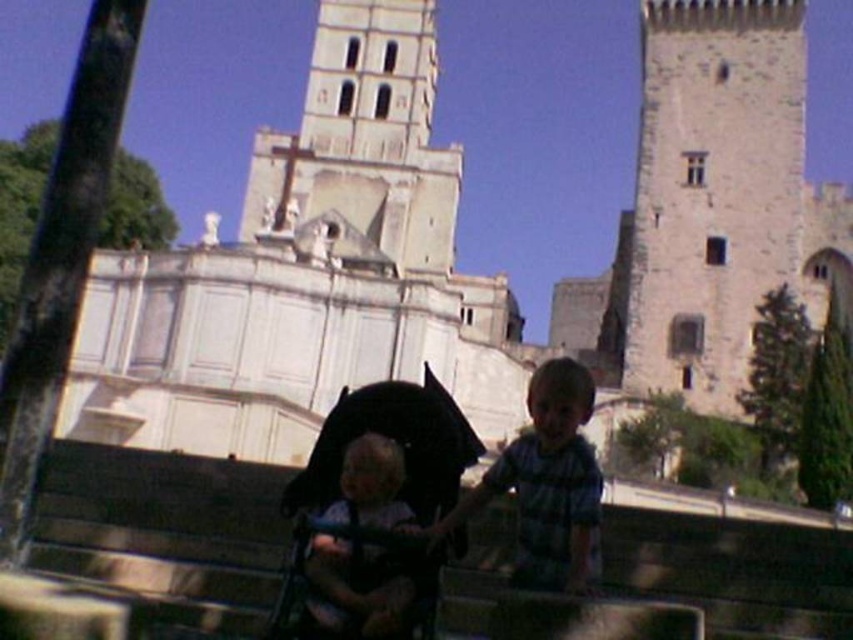
The image size is (853, 640). What do you see at coordinates (364, 136) in the screenshot?
I see `white stone tower at upper center` at bounding box center [364, 136].

Describe the element at coordinates (364, 136) in the screenshot. Image resolution: width=853 pixels, height=640 pixels. I see `white stone tower at upper center` at that location.

Where is `white stone tower at upper center`? white stone tower at upper center is located at coordinates (364, 136).

Which of these two, striped cotton shirt at center or light brown hair at center, stands taller?

A: striped cotton shirt at center is taller.

You are a GUI agent. You are given a task and a screenshot of the screen. Output one action in this format:
    pyautogui.click(x=<x>, y=<y>)
    Task: Click on the striped cotton shirt at center
    The height and width of the screenshot is (640, 853).
    Given the screenshot: What is the action you would take?
    pyautogui.click(x=547, y=484)

Which is in front, point (415, 436) or point (345, 579)?

Point (345, 579) is in front.

Does black fabric baby carriage at center have a larger size compared to light brown hair at center?

Yes.

Between point (421, 448) and point (339, 509), which one is positioned in front?

Point (339, 509) is more forward.

The height and width of the screenshot is (640, 853). In order to click on black fabric baby carriage at center in this screenshot , I will do `click(397, 442)`.